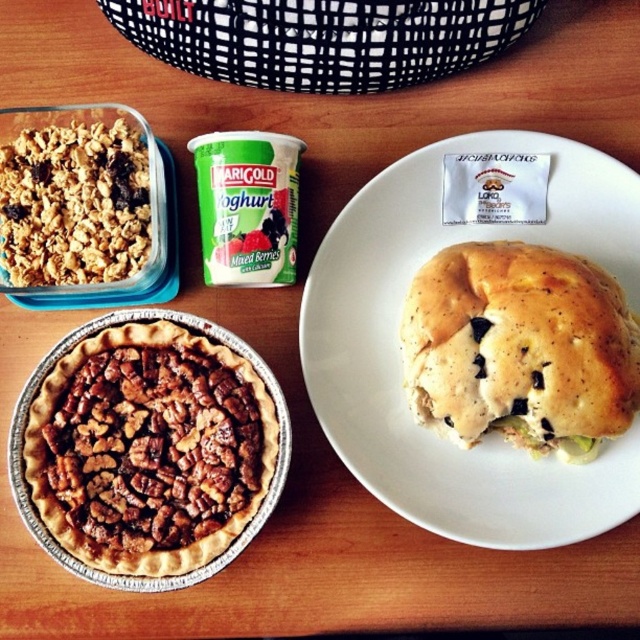
Based on the photo, what is the 2D coordinate of the brown crumbly pie at lower left?

The brown crumbly pie at lower left is located at the 2D coordinate point of (148, 449).